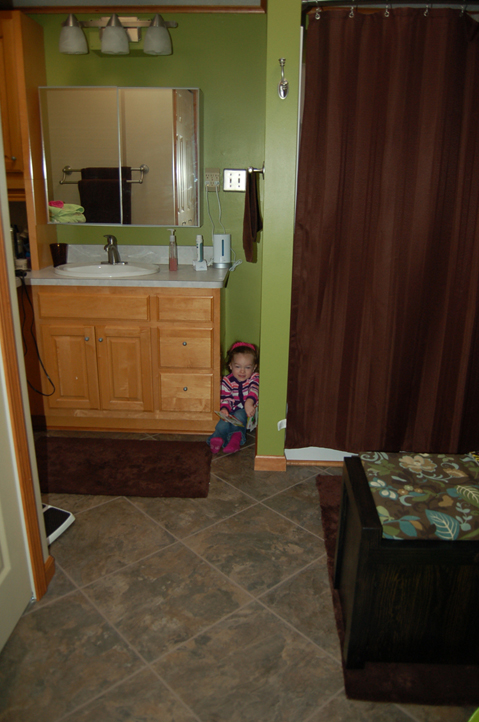
This screenshot has height=722, width=479. Find the location of `mirror`. mirror is located at coordinates (109, 165).